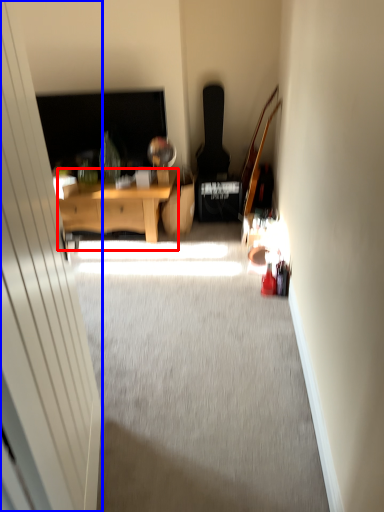
Question: Among these objects, which one is nearest to the camera, desk (highlighted by a red box) or glass door (highlighted by a blue box)?

Choices:
 (A) desk
 (B) glass door

Answer: (B)